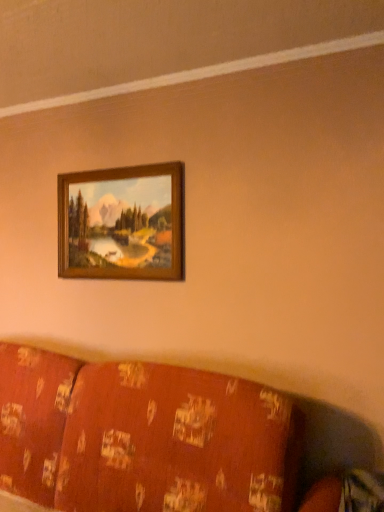
What do you see at coordinates (143, 437) in the screenshot?
I see `patterned fabric couch at lower center` at bounding box center [143, 437].

The width and height of the screenshot is (384, 512). What are the coordinates of `patterned fabric couch at lower center` in the screenshot? It's located at (143, 437).

You are a GUI agent. You are given a task and a screenshot of the screen. Output one action in this format:
    pyautogui.click(x=<x>, y=<y>)
    Task: Click on the wooden frame at upper center
    The image size is (384, 512).
    Given the screenshot: What is the action you would take?
    pyautogui.click(x=122, y=223)

Image resolution: width=384 pixels, height=512 pixels. What do you see at coordinates (122, 223) in the screenshot?
I see `wooden frame at upper center` at bounding box center [122, 223].

Identify the location of patterned fabric couch at lower center. The image size is (384, 512). pos(143,437).

Is patterned fabric couch at lower center to the left of wooden frame at upper center from the viewer's perspective?

Correct, you'll find patterned fabric couch at lower center to the left of wooden frame at upper center.

Consider the image. Which object is closer to the camera taking this photo, patterned fabric couch at lower center or wooden frame at upper center?

patterned fabric couch at lower center is closer to the camera.

Is point (62, 489) in front of point (172, 231)?

That is True.

From the image's perspective, which is above, patterned fabric couch at lower center or wooden frame at upper center?

wooden frame at upper center, from the image's perspective.

From a real-world perspective, between patterned fabric couch at lower center and wooden frame at upper center, who is vertically higher?

In real-world perspective, wooden frame at upper center is above.

From the picture: Considering the relative sizes of patterned fabric couch at lower center and wooden frame at upper center in the image provided, is patterned fabric couch at lower center thinner than wooden frame at upper center?

In fact, patterned fabric couch at lower center might be wider than wooden frame at upper center.

Considering the sizes of patterned fabric couch at lower center and wooden frame at upper center in the image, is patterned fabric couch at lower center taller or shorter than wooden frame at upper center?

In the image, patterned fabric couch at lower center appears to be taller than wooden frame at upper center.

Looking at the image, does patterned fabric couch at lower center seem bigger or smaller compared to wooden frame at upper center?

Considering their sizes, patterned fabric couch at lower center takes up more space than wooden frame at upper center.

Which is correct: patterned fabric couch at lower center is inside wooden frame at upper center, or outside of it?

patterned fabric couch at lower center cannot be found inside wooden frame at upper center.

Does patterned fabric couch at lower center touch wooden frame at upper center?

No, patterned fabric couch at lower center is not next to wooden frame at upper center.

Could you tell me if patterned fabric couch at lower center is facing wooden frame at upper center?

No, patterned fabric couch at lower center is not oriented towards wooden frame at upper center.

Identify the location of furniture to the left of wooden frame at upper center. This screenshot has width=384, height=512. (143, 437).

In the scene shown: Between wooden frame at upper center and patterned fabric couch at lower center, which one appears on the right side from the viewer's perspective?

wooden frame at upper center.

Which is behind, wooden frame at upper center or patterned fabric couch at lower center?

wooden frame at upper center is further from the camera.

Considering the points (145, 204) and (47, 442), which point is in front, point (145, 204) or point (47, 442)?

Point (47, 442)

From the image's perspective, is wooden frame at upper center below patterned fabric couch at lower center?

Actually, wooden frame at upper center appears above patterned fabric couch at lower center in the image.

From a real-world perspective, which is physically below, wooden frame at upper center or patterned fabric couch at lower center?

From a 3D spatial view, patterned fabric couch at lower center is below.

Consider the image. Is wooden frame at upper center wider or thinner than patterned fabric couch at lower center?

Clearly, wooden frame at upper center has less width compared to patterned fabric couch at lower center.

Is wooden frame at upper center taller or shorter than patterned fabric couch at lower center?

wooden frame at upper center is shorter than patterned fabric couch at lower center.

Considering the sizes of wooden frame at upper center and patterned fabric couch at lower center in the image, is wooden frame at upper center bigger or smaller than patterned fabric couch at lower center?

wooden frame at upper center is smaller than patterned fabric couch at lower center.

Based on the photo, is wooden frame at upper center spatially inside patterned fabric couch at lower center, or outside of it?

wooden frame at upper center cannot be found inside patterned fabric couch at lower center.

Are wooden frame at upper center and patterned fabric couch at lower center beside each other?

No, wooden frame at upper center is not beside patterned fabric couch at lower center.

Is wooden frame at upper center turned away from patterned fabric couch at lower center?

wooden frame at upper center is not turned away from patterned fabric couch at lower center.

Measure the distance from wooden frame at upper center to patterned fabric couch at lower center.

wooden frame at upper center and patterned fabric couch at lower center are 80.36 centimeters apart.

Image resolution: width=384 pixels, height=512 pixels. In order to click on picture frame positioned vertically above the patterned fabric couch at lower center (from a real-world perspective) in this screenshot , I will do `click(122, 223)`.

Image resolution: width=384 pixels, height=512 pixels. In order to click on picture frame behind the patterned fabric couch at lower center in this screenshot , I will do `click(122, 223)`.

This screenshot has width=384, height=512. Identify the location of furniture lying below the wooden frame at upper center (from the image's perspective). (143, 437).